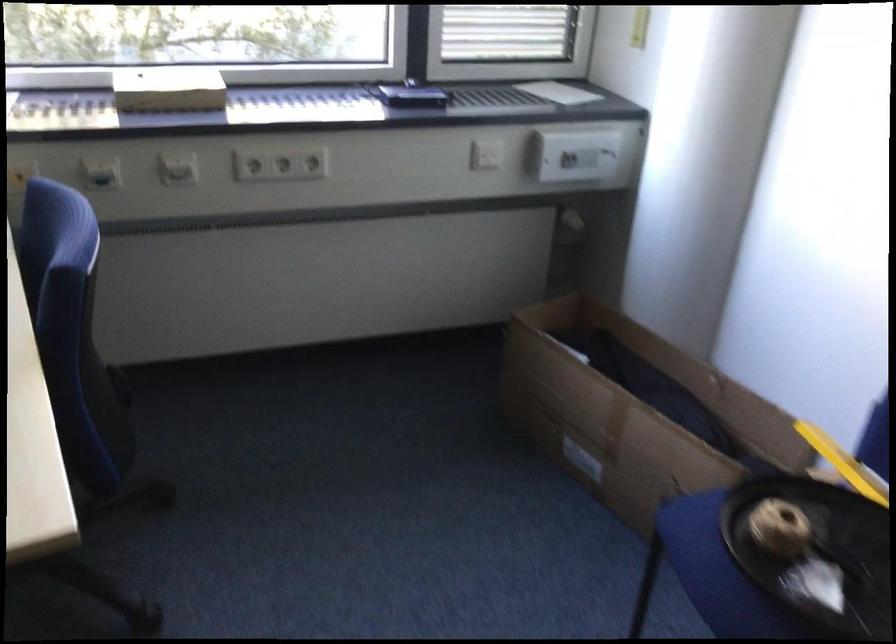
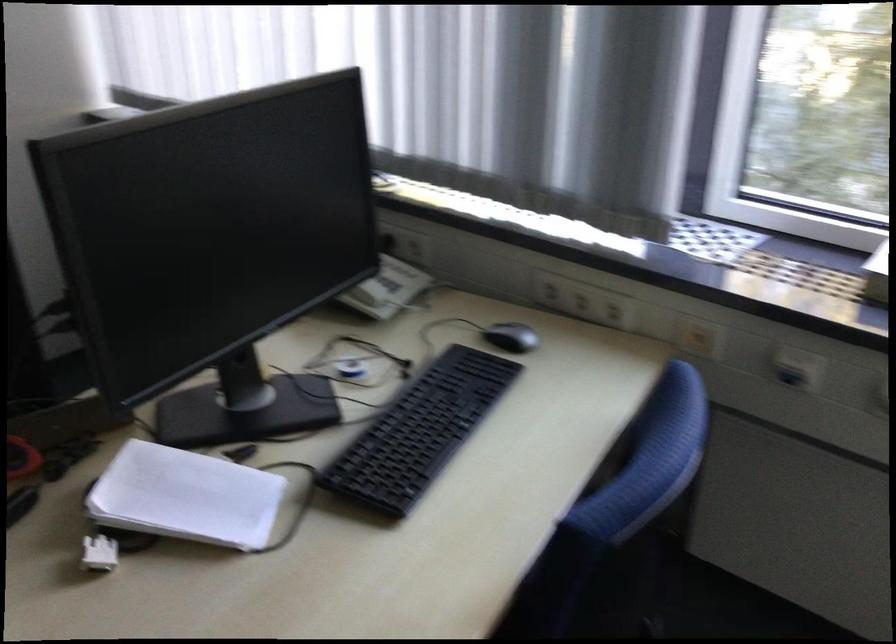
Question: The images are taken continuously from a first-person perspective. In which direction is your viewpoint rotating?

Choices:
 (A) Left
 (B) Right
 (C) Up
 (D) Down

Answer: (A)